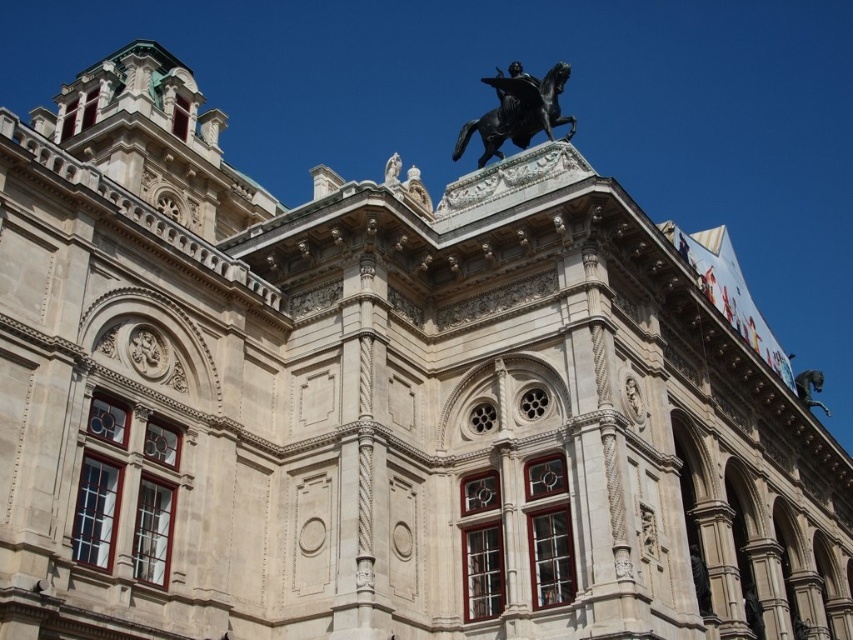
Question: Which point is closer to the camera?

Choices:
 (A) black polished bronze horse at upper center
 (B) black metal horse at upper right

Answer: (A)

Question: Does black polished bronze horse at upper center lie in front of black metal horse at upper right?

Choices:
 (A) yes
 (B) no

Answer: (A)

Question: Which point appears closest to the camera in this image?

Choices:
 (A) (489, 147)
 (B) (821, 388)

Answer: (A)

Question: Which point is farther from the camera taking this photo?

Choices:
 (A) (532, 104)
 (B) (807, 394)

Answer: (B)

Question: Does black polished bronze horse at upper center have a smaller size compared to black metal horse at upper right?

Choices:
 (A) yes
 (B) no

Answer: (B)

Question: Does black polished bronze horse at upper center appear on the right side of black metal horse at upper right?

Choices:
 (A) no
 (B) yes

Answer: (A)